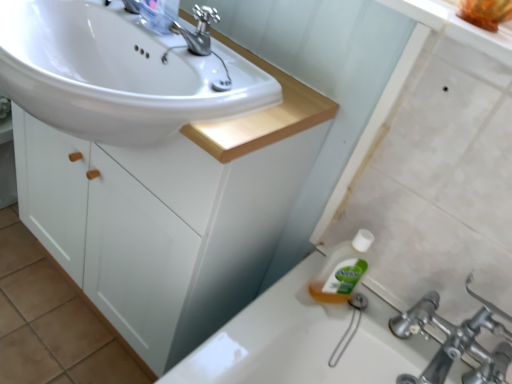
You are a GUI agent. You are given a task and a screenshot of the screen. Output one action in this format:
    pyautogui.click(x=<x>, y=<y>)
    Task: Click on the polished metallic faucet at upper center
    The image size is (512, 384).
    Given the screenshot: What is the action you would take?
    pyautogui.click(x=198, y=30)

Image resolution: width=512 pixels, height=384 pixels. What do you see at coordinates (198, 30) in the screenshot?
I see `polished metallic faucet at upper center` at bounding box center [198, 30].

What do you see at coordinates (158, 14) in the screenshot? This screenshot has width=512, height=384. I see `clear plastic bottle at upper center` at bounding box center [158, 14].

Find the location of a particular element. The image size is (512, 384). white matte cabinet at center is located at coordinates (160, 226).

Is the position of white matte cabinet at center less distant than that of polished metallic faucet at upper center?

Yes.

Considering the relative positions of white matte cabinet at center and polished metallic faucet at upper center in the image provided, is white matte cabinet at center to the right of polished metallic faucet at upper center from the viewer's perspective?

Incorrect, white matte cabinet at center is not on the right side of polished metallic faucet at upper center.

From the image's perspective, which one is positioned lower, white matte cabinet at center or polished metallic faucet at upper center?

white matte cabinet at center.

Is point (154, 221) less distant than point (201, 37)?

No, it is behind (201, 37).

Considering the sizes of objects white glossy sink at upper left and clear plastic bottle at upper center in the image provided, who is shorter, white glossy sink at upper left or clear plastic bottle at upper center?

With less height is white glossy sink at upper left.

Which object is further away from the camera taking this photo, white glossy sink at upper left or clear plastic bottle at upper center?

clear plastic bottle at upper center is further from the camera.

Is white glossy sink at upper left looking in the opposite direction of clear plastic bottle at upper center?

That's not correct — white glossy sink at upper left is not looking away from clear plastic bottle at upper center.

Visually, is white glossy sink at upper left positioned to the left or to the right of white matte cabinet at center?

From the image, it's evident that white glossy sink at upper left is to the right of white matte cabinet at center.

Which is behind, point (75, 116) or point (172, 256)?

The point (172, 256) is farther from the camera.

Is white glossy sink at upper left spatially inside white matte cabinet at center, or outside of it?

white glossy sink at upper left is located inside white matte cabinet at center.

Considering the sizes of objects white glossy sink at upper left and white matte cabinet at center in the image provided, who is smaller, white glossy sink at upper left or white matte cabinet at center?

Smaller between the two is white glossy sink at upper left.

From a real-world perspective, is clear plastic bottle at upper center positioned above or below polished metallic faucet at upper center?

From a real-world perspective, clear plastic bottle at upper center is physically above polished metallic faucet at upper center.

Considering the sizes of objects clear plastic bottle at upper center and polished metallic faucet at upper center in the image provided, who is shorter, clear plastic bottle at upper center or polished metallic faucet at upper center?

With less height is polished metallic faucet at upper center.

Which is more distant, (x=166, y=30) or (x=205, y=20)?

The point (x=166, y=30) is more distant.

Could you tell me if clear plastic bottle at upper center is turned towards polished metallic faucet at upper center?

No, clear plastic bottle at upper center does not turn towards polished metallic faucet at upper center.

In the scene shown: Measure the distance between polished metallic faucet at upper center and white glossy sink at upper left.

polished metallic faucet at upper center is 6.28 inches from white glossy sink at upper left.

From the image's perspective, relative to white glossy sink at upper left, is polished metallic faucet at upper center above or below?

From the image's perspective, polished metallic faucet at upper center appears above white glossy sink at upper left.

Would you say polished metallic faucet at upper center is outside white glossy sink at upper left?

Yes, polished metallic faucet at upper center is located beyond the bounds of white glossy sink at upper left.

Which of these two, polished metallic faucet at upper center or white glossy sink at upper left, stands shorter?

With less height is polished metallic faucet at upper center.

Is clear plastic bottle at upper center smaller than white matte cabinet at center?

Yes, clear plastic bottle at upper center is smaller than white matte cabinet at center.

Is the position of clear plastic bottle at upper center more distant than that of white matte cabinet at center?

Yes, clear plastic bottle at upper center is further from the camera.

Which is correct: clear plastic bottle at upper center is inside white matte cabinet at center, or outside of it?

clear plastic bottle at upper center lies outside white matte cabinet at center.

Between point (238, 176) and point (149, 70), which one is positioned in front?

The point (238, 176) is in front.

Is white matte cabinet at center taller than white glossy sink at upper left?

Yes, white matte cabinet at center is taller than white glossy sink at upper left.

Between white matte cabinet at center and white glossy sink at upper left, which one is positioned behind?

Positioned behind is white matte cabinet at center.

This screenshot has height=384, width=512. Identify the location of bathroom cabinet that is under the polished metallic faucet at upper center (from a real-world perspective). (160, 226).

Image resolution: width=512 pixels, height=384 pixels. In the image, there is a clear plastic bottle at upper center. In order to click on sink below it (from the image's perspective) in this screenshot , I will do `click(117, 74)`.

From the image, which object appears to be nearer to white glossy sink at upper left, white matte cabinet at center or clear plastic bottle at upper center?

Among the two, clear plastic bottle at upper center is located nearer to white glossy sink at upper left.

Based on their spatial positions, is white glossy sink at upper left or white matte cabinet at center further from polished metallic faucet at upper center?

white matte cabinet at center lies further to polished metallic faucet at upper center than the other object.

Which object lies nearer to the anchor point clear plastic bottle at upper center, polished metallic faucet at upper center or white matte cabinet at center?

polished metallic faucet at upper center lies closer to clear plastic bottle at upper center than the other object.

Based on their spatial positions, is clear plastic bottle at upper center or polished metallic faucet at upper center further from white matte cabinet at center?

clear plastic bottle at upper center is positioned further to the anchor white matte cabinet at center.

Based on their spatial positions, is polished metallic faucet at upper center or white matte cabinet at center closer to white glossy sink at upper left?

Among the two, polished metallic faucet at upper center is located nearer to white glossy sink at upper left.

Based on their spatial positions, is white matte cabinet at center or clear plastic bottle at upper center further from polished metallic faucet at upper center?

Based on the image, white matte cabinet at center appears to be further to polished metallic faucet at upper center.

Estimate the real-world distances between objects in this image. Which object is further from polished metallic faucet at upper center, clear plastic bottle at upper center or white matte cabinet at center?

Among the two, white matte cabinet at center is located further to polished metallic faucet at upper center.

Looking at the image, which one is located further to polished metallic faucet at upper center, white matte cabinet at center or white glossy sink at upper left?

Among the two, white matte cabinet at center is located further to polished metallic faucet at upper center.

The image size is (512, 384). In order to click on sink between clear plastic bottle at upper center and white matte cabinet at center in the up-down direction in this screenshot , I will do [x=117, y=74].

What are the coordinates of `sink between polished metallic faucet at upper center and white matte cabinet at center vertically` in the screenshot? It's located at (117, 74).

At what (x,y) coordinates should I click in order to perform the action: click on tap between clear plastic bottle at upper center and white matte cabinet at center in the vertical direction. Please return your answer as a coordinate pair (x, y). Looking at the image, I should click on (198, 30).

At what (x,y) coordinates should I click in order to perform the action: click on tap between white glossy sink at upper left and clear plastic bottle at upper center along the z-axis. Please return your answer as a coordinate pair (x, y). Looking at the image, I should click on (198, 30).